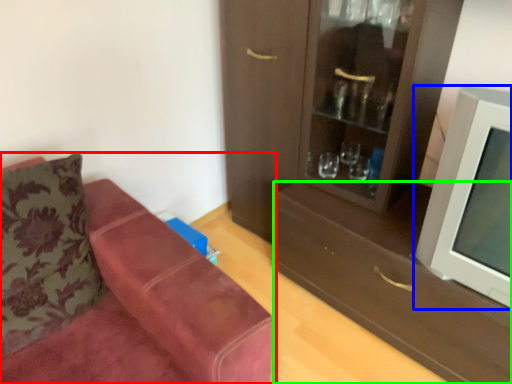
Question: Which object is the farthest from studio couch (highlighted by a red box)? Choose among these: television (highlighted by a blue box) or drawer (highlighted by a green box).

Choices:
 (A) television
 (B) drawer

Answer: (A)